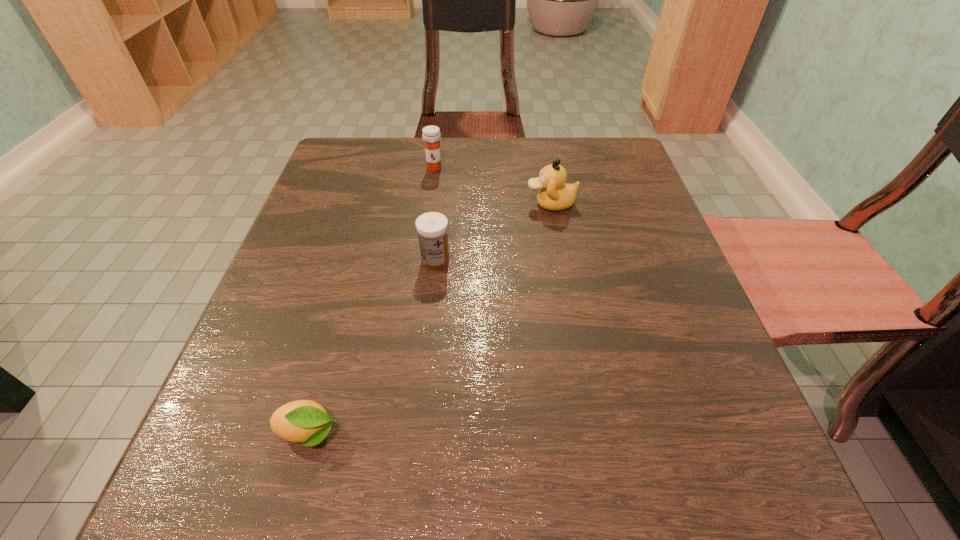
Identify the location of blank space located on the front of the third farthest object. This screenshot has height=540, width=960. (427, 342).

Locate an element on the screen. The width and height of the screenshot is (960, 540). vacant space located with leaves positioned above the leftmost object is located at coordinates (454, 433).

This screenshot has width=960, height=540. In order to click on object positioned at the far edge in this screenshot , I will do `click(431, 135)`.

Where is `object that is at the near edge`? This screenshot has height=540, width=960. object that is at the near edge is located at coordinates (303, 421).

Where is `object located at the left edge`? The width and height of the screenshot is (960, 540). object located at the left edge is located at coordinates (303, 421).

Where is `object at the right edge`? The width and height of the screenshot is (960, 540). object at the right edge is located at coordinates (555, 194).

You are a GUI agent. You are given a task and a screenshot of the screen. Output one action in this format:
    pyautogui.click(x=<x>, y=<y>)
    Task: Click on the object that is at the near left corner
    The image size is (960, 540).
    Given the screenshot: What is the action you would take?
    pyautogui.click(x=303, y=421)

I want to click on free location at the far edge of the desktop, so [506, 140].

Find the location of a particular element. free location at the near edge of the desktop is located at coordinates (354, 458).

I want to click on blank space at the left edge of the desktop, so click(317, 319).